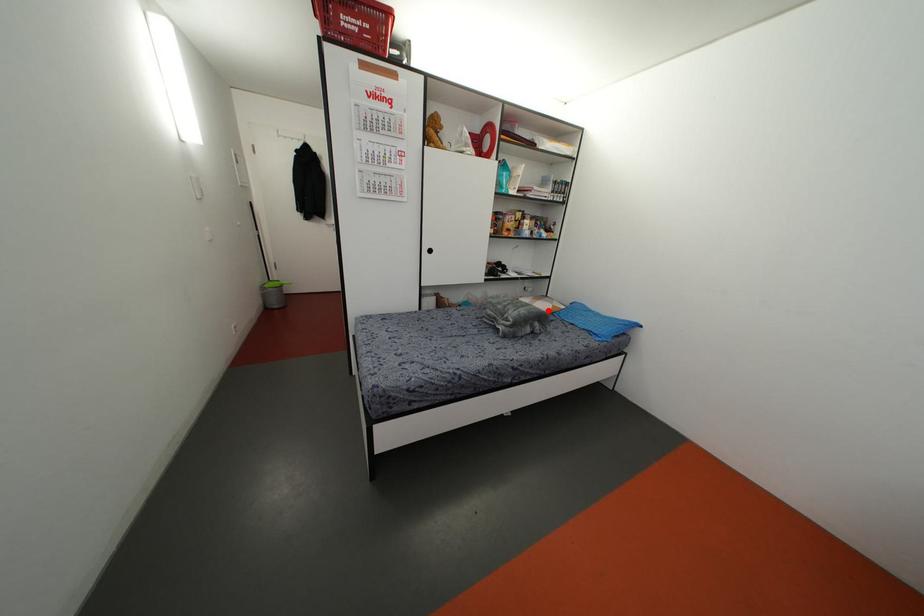
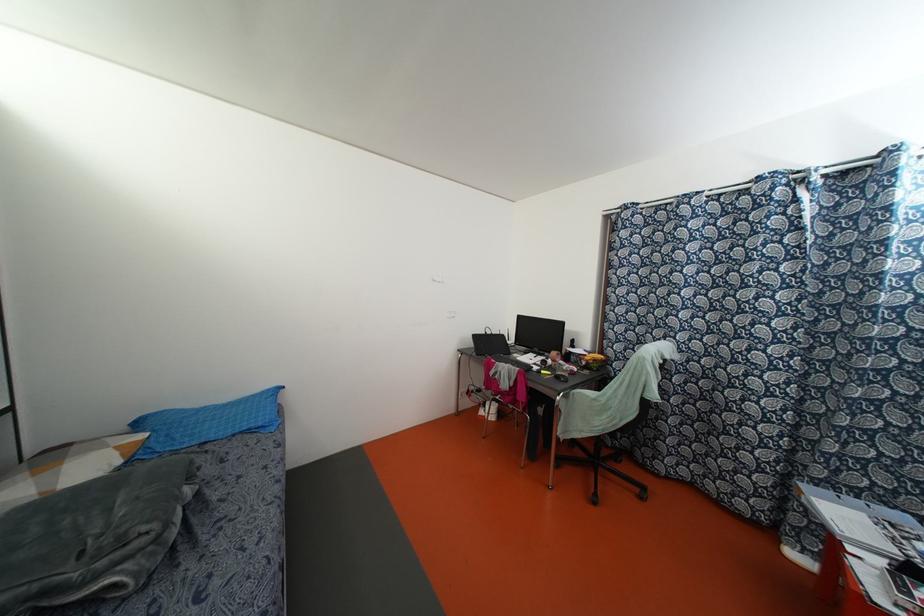
The point at the highlighted location is marked in the first image. Where is the corresponding point in the second image?

(118, 461)